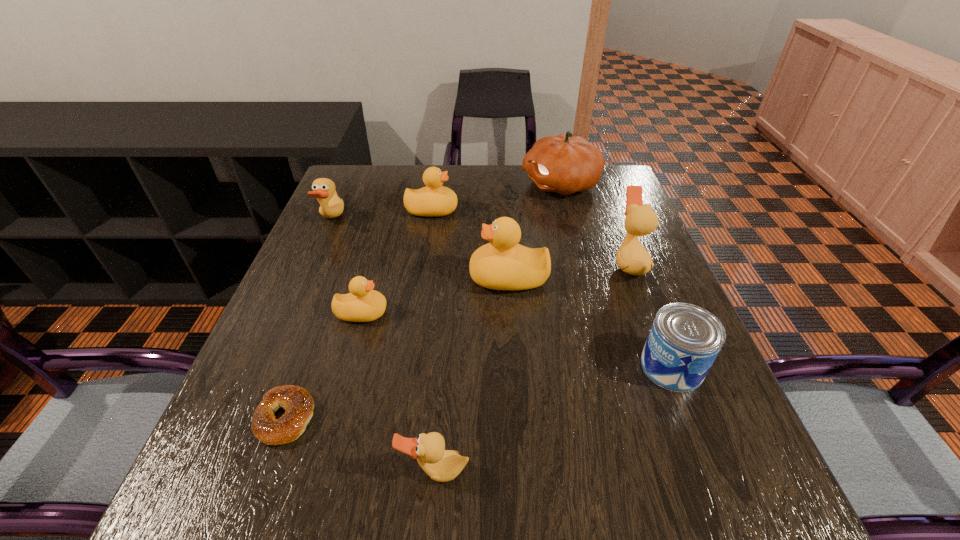
Find the location of a particular element. free spot located 0.390m on the back of the bagel is located at coordinates (345, 254).

In order to click on pumpkin that is positioned at the far edge in this screenshot , I will do `click(563, 164)`.

Find the location of `object at the near edge`. object at the near edge is located at coordinates tap(441, 465).

I want to click on bagel at the left edge, so click(x=297, y=402).

Image resolution: width=960 pixels, height=540 pixels. I want to click on pumpkin at the right edge, so click(x=563, y=164).

Locate an element on the screen. The image size is (960, 540). duck that is at the right edge is located at coordinates (632, 258).

Find the location of a particular element. can that is positioned at the right edge is located at coordinates (684, 341).

Find the location of a particular element. object positioned at the far left corner is located at coordinates (332, 206).

The height and width of the screenshot is (540, 960). Identify the location of object positioned at the far right corner. (563, 164).

In the image, there is a desktop. Identify the location of free region at the far edge. (544, 204).